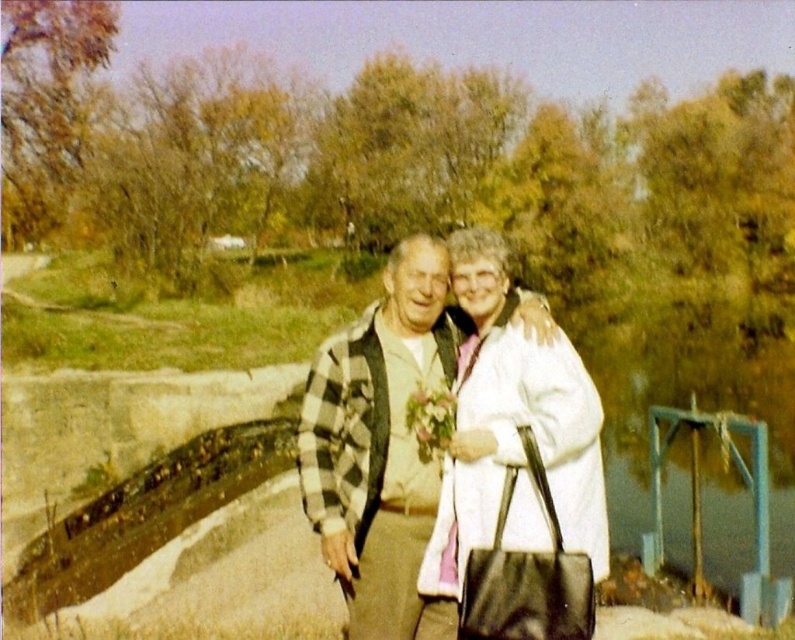
Is point (379, 573) positioned in front of point (432, 397)?

No, (379, 573) is further to viewer.

Find the location of a particular element. The width and height of the screenshot is (795, 640). matte black jacket at center is located at coordinates (415, 440).

Locate an element on the screen. Image resolution: width=795 pixels, height=640 pixels. matte black jacket at center is located at coordinates (415, 440).